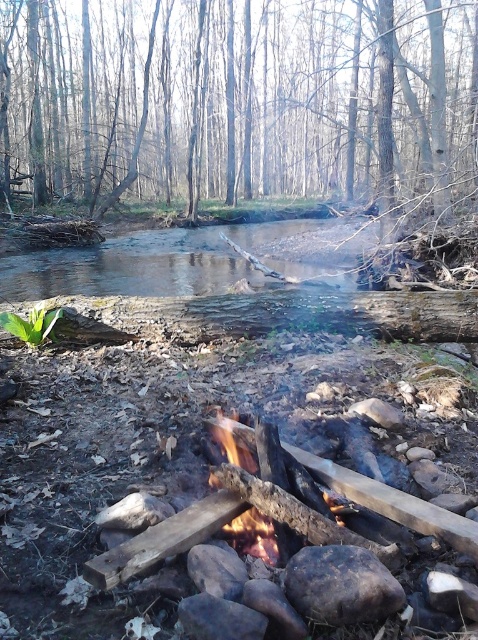
Question: Can you confirm if brown wood tree at upper center is positioned to the right of charred wood fire at center?

Choices:
 (A) yes
 (B) no

Answer: (B)

Question: Which of the following is the farthest from the observer?

Choices:
 (A) (69, 285)
 (B) (246, 532)
 (C) (389, 42)

Answer: (C)

Question: Can you confirm if brown wood tree at upper center is positioned above charred wood fire at center?

Choices:
 (A) no
 (B) yes

Answer: (B)

Question: Which point is farther to the camera?

Choices:
 (A) charred wood fire at center
 (B) clear water at center
 (C) brown wood tree at upper center

Answer: (C)

Question: Can you confirm if clear water at center is positioned to the left of charred wood fire at center?

Choices:
 (A) no
 (B) yes

Answer: (B)

Question: Based on their relative distances, which object is nearer to the brown wood tree at upper center?

Choices:
 (A) clear water at center
 (B) charred wood fire at center

Answer: (A)